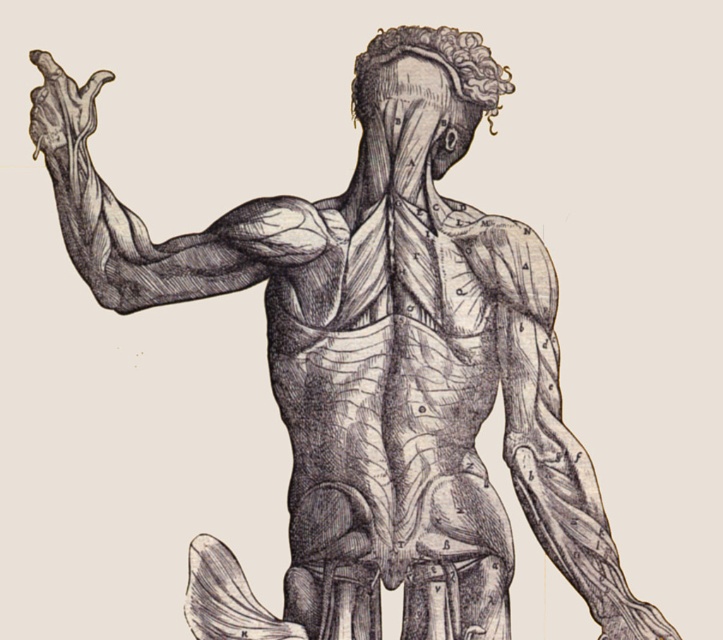
You are a medical student observing the anatomical illustration. You notice the smooth black arm at upper left and the smooth skin hand at upper left. Based on their positions, which object is located lower in the image?

The smooth black arm at upper left is located below the smooth skin hand at upper left, so the smooth black arm at upper left is lower in the image.

You are a medical student observing the anatomical illustration. You notice the smooth black arm at upper left and the smooth skin hand at upper left. Which object is positioned closer to your viewpoint?

The smooth black arm at upper left is closer to the viewer than the smooth skin hand at upper left.

You are a medical student observing the anatomical illustration. You notice the smooth black arm at upper left and the smooth skin hand at upper left. Which of these two objects has a larger height in the illustration?

The smooth black arm at upper left has a greater height compared to the smooth skin hand at upper left, so the smooth black arm at upper left is taller.